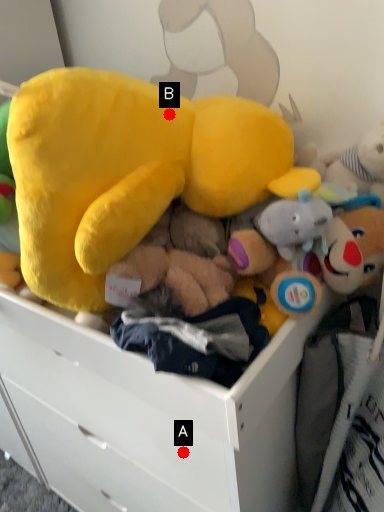
Question: Two points are circled on the image, labeled by A and B beside each circle. Among these points, which one is farthest from the camera?

Choices:
 (A) A is further
 (B) B is further

Answer: (A)